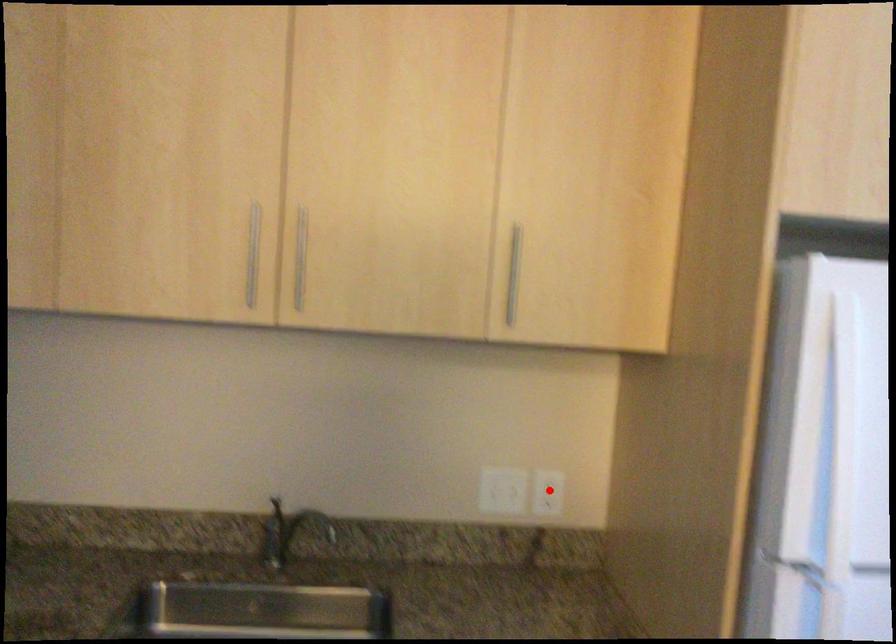
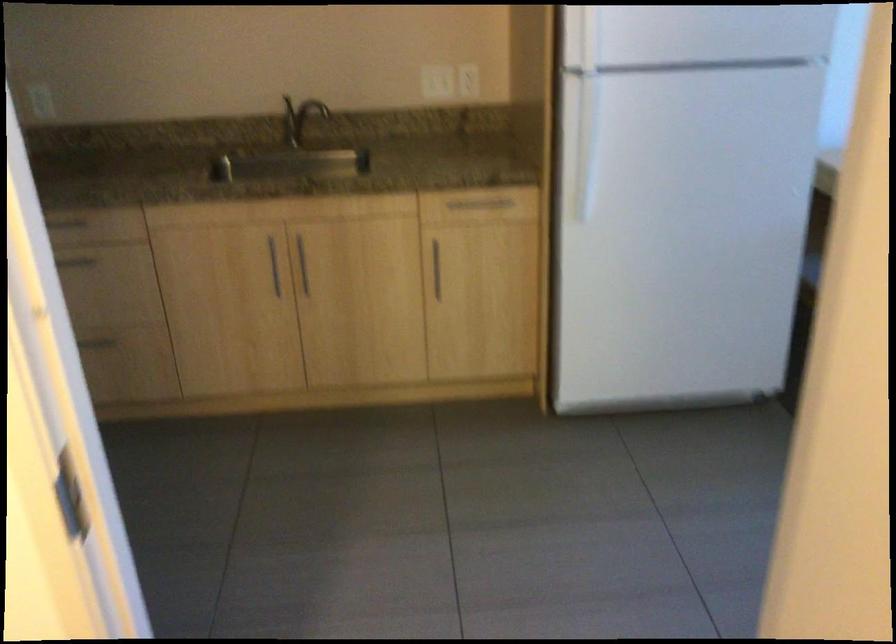
Where in the second image is the point corresponding to the highlighted location from the first image?

(468, 80)